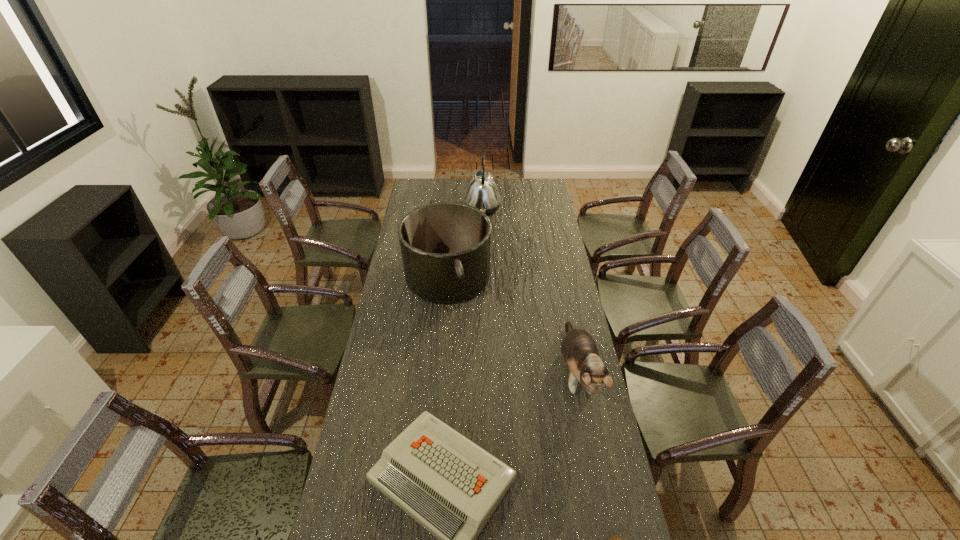
The height and width of the screenshot is (540, 960). What are the coordinates of `object identified as the closest to the farthest object` in the screenshot? It's located at (445, 247).

Select which object appears as the fourth closest to the fourth nearest object. Please provide its 2D coordinates. Your answer should be formatted as a tuple, i.e. [(x, y)], where the tuple contains the x and y coordinates of a point satisfying the conditions above.

[(609, 539)]